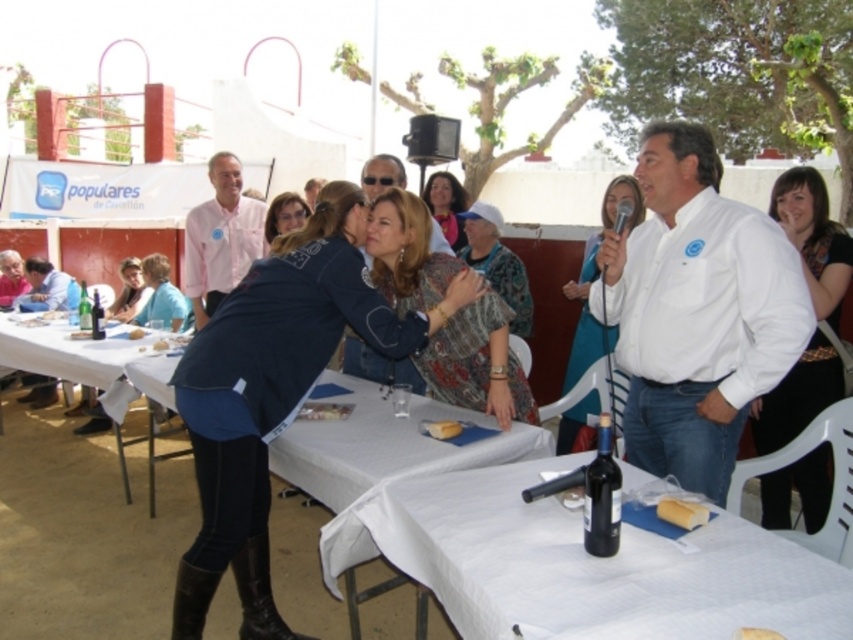
Based on the scene description, which object is taller between the patterned fabric dress at center and the light brown leather jacket at upper left?

The patterned fabric dress at center is much taller than the light brown leather jacket at upper left.

Consider the image. You are organizing a photo shoot and need to place a small prop between the matte black jacket at lower left and the smooth pink shirt at center. Given their sizes, which object should the prop be closer to to maintain balance?

The prop should be closer to the smooth pink shirt at center because the matte black jacket at lower left is larger in size, so placing the prop nearer to the smaller object helps balance the composition.

You are a guest at this event and want to choose the smaller piece of bread. Which one should you pick between the white bread at table center and the white bread at center?

The white bread at table center is smaller compared to the white bread at center, so you should pick the white bread at table center.